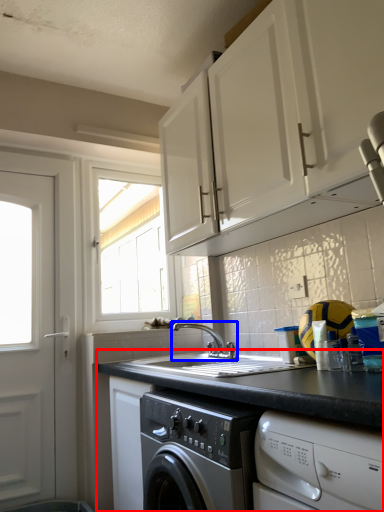
Question: Among these objects, which one is farthest to the camera, countertop (highlighted by a red box) or tap (highlighted by a blue box)?

Choices:
 (A) countertop
 (B) tap

Answer: (B)